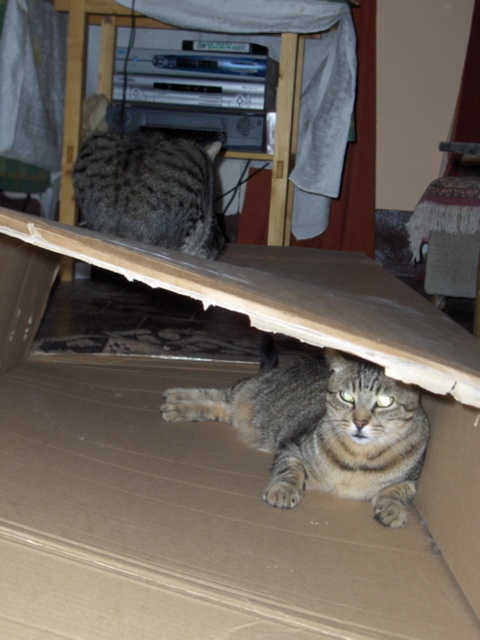
Is brown cardboard box at lower center above gray striped cat at center?

Actually, brown cardboard box at lower center is below gray striped cat at center.

Does brown cardboard box at lower center have a larger size compared to gray striped cat at center?

Yes.

Who is more distant from viewer, (324,596) or (118,145)?

Positioned behind is point (118,145).

Find the location of a particular element. The image size is (480, 640). brown cardboard box at lower center is located at coordinates (227, 460).

At what (x,y) coordinates should I click in order to perform the action: click on brown cardboard box at lower center. Please return your answer as a coordinate pair (x, y). Looking at the image, I should click on (227, 460).

Can you confirm if brown cardboard box at lower center is smaller than tabby fur cat at lower center?

No, brown cardboard box at lower center is not smaller than tabby fur cat at lower center.

Identify the location of brown cardboard box at lower center. pyautogui.click(x=227, y=460).

Does tabby fur cat at lower center have a greater height compared to gray striped cat at center?

In fact, tabby fur cat at lower center may be shorter than gray striped cat at center.

Which is behind, point (322, 412) or point (220, 248)?

Positioned behind is point (220, 248).

The height and width of the screenshot is (640, 480). What do you see at coordinates (322, 428) in the screenshot?
I see `tabby fur cat at lower center` at bounding box center [322, 428].

Identify the location of tabby fur cat at lower center. pos(322,428).